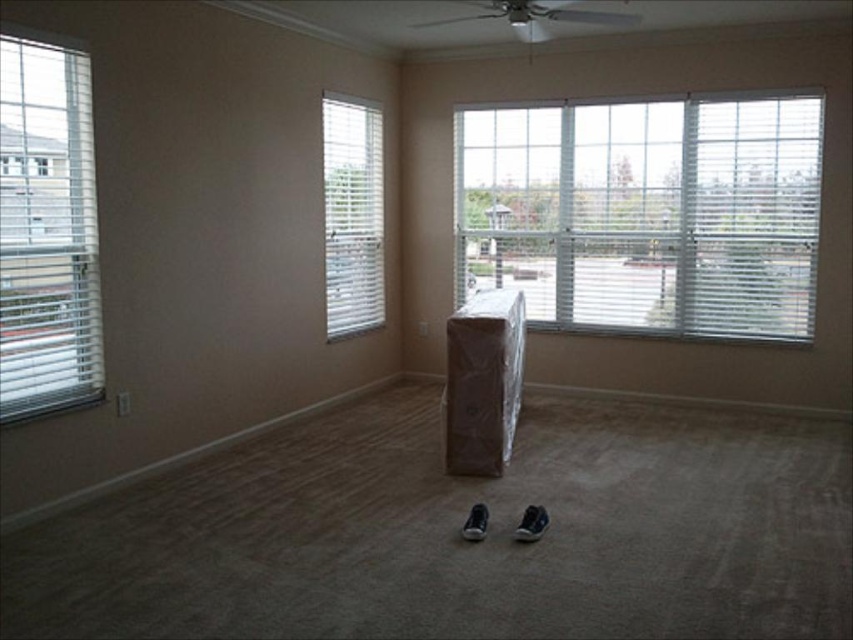
Question: Is white textured blinds at upper right in front of black leather shoe at lower center?

Choices:
 (A) yes
 (B) no

Answer: (B)

Question: Estimate the real-world distances between objects in this image. Which object is closer to the white blinds at left?

Choices:
 (A) white textured blinds at upper right
 (B) black leather shoe at lower center
 (C) black suede shoe at center
 (D) white blinds at center

Answer: (D)

Question: Which object is the closest to the white blinds at center?

Choices:
 (A) white blinds at left
 (B) black suede shoe at center
 (C) black leather shoe at lower center

Answer: (A)

Question: Does white blinds at center have a lesser width compared to black leather shoe at lower center?

Choices:
 (A) no
 (B) yes

Answer: (A)

Question: Which object is closer to the camera taking this photo?

Choices:
 (A) white blinds at left
 (B) white textured blinds at upper right

Answer: (A)

Question: Can you confirm if white textured blinds at upper right is bigger than white blinds at left?

Choices:
 (A) no
 (B) yes

Answer: (B)